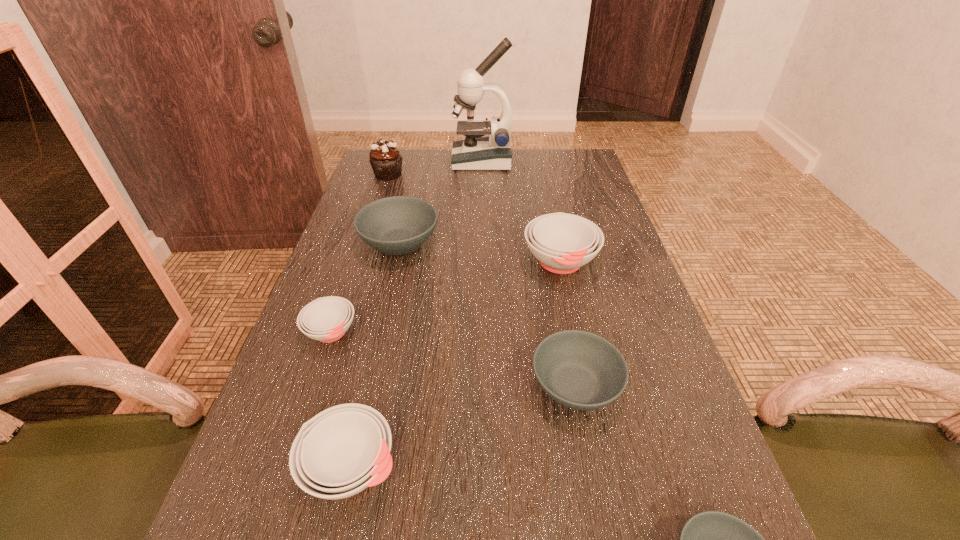
Locate an element on the screen. The width and height of the screenshot is (960, 540). vacant region that satisfies the following two spatial constraints: 1. on the front side of the nearest white soup bowl; 2. on the right side of the cupcake is located at coordinates (293, 467).

Where is `free space that satisfies the following two spatial constraints: 1. at the eyepiece of the microscope; 2. on the right side of the biggest white soup bowl`? free space that satisfies the following two spatial constraints: 1. at the eyepiece of the microscope; 2. on the right side of the biggest white soup bowl is located at coordinates (483, 262).